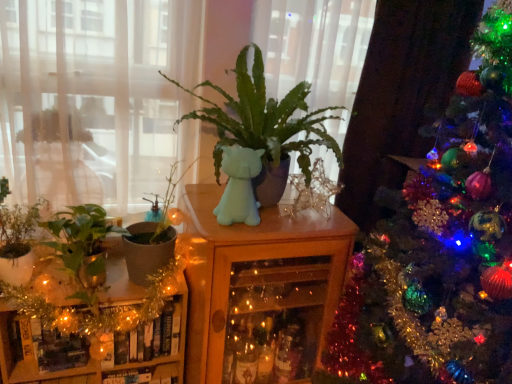
Question: From the image's perspective, is shiny green christmas tree at right above or below gold tinsel garland at lower left, the 1th furniture in the left-to-right sequence?

Choices:
 (A) below
 (B) above

Answer: (B)

Question: Does point (394, 228) appear closer or farther from the camera than point (30, 296)?

Choices:
 (A) farther
 (B) closer

Answer: (B)

Question: Which object is the farthest from the transparent glass window at upper left?

Choices:
 (A) wooden cabinet at center, positioned as the 2th furniture in left-to-right order
 (B) gold tinsel garland at lower left, the 1th furniture in the left-to-right sequence
 (C) green matte pot at left, marked as the third houseplant in a left-to-right arrangement
 (D) green matte plant at center, which is counted as the first houseplant, starting from the right
 (E) shiny green christmas tree at right

Answer: (E)

Question: Based on their relative distances, which object is nearer to the transparent glass window at upper left?

Choices:
 (A) green matte pot at left, marked as the third houseplant in a left-to-right arrangement
 (B) gold tinsel garland at lower left, the 1th furniture in the left-to-right sequence
 (C) green matte plant at center, which is counted as the first houseplant, starting from the right
 (D) green matte plant at left, positioned as the 2th houseplant in left-to-right order
 (E) green matte plant at left, arranged as the first houseplant when viewed from the left

Answer: (C)